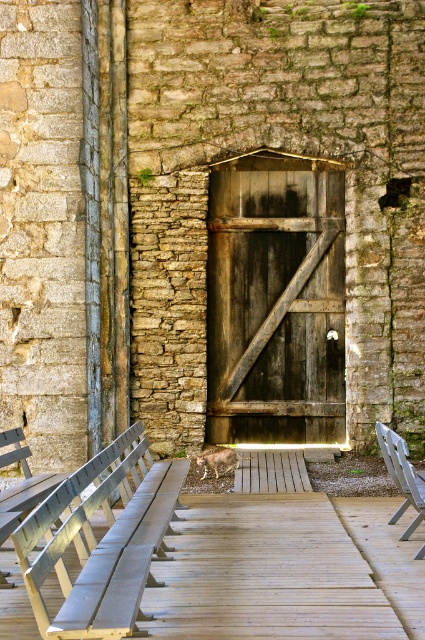
Question: Can you confirm if wooden bench at lower left is wider than metallic silver bench at center?

Choices:
 (A) no
 (B) yes

Answer: (B)

Question: Which point is closer to the camera?

Choices:
 (A) (410, 492)
 (B) (121, 460)
 (C) (283, 298)

Answer: (A)

Question: Can you confirm if wooden bench at lower left is positioned to the right of metallic silver bench at center?

Choices:
 (A) no
 (B) yes

Answer: (A)

Question: Which point is farther to the camera?

Choices:
 (A) metallic silver bench at center
 (B) wooden bench at lower left
 (C) dark brown wooden door at center

Answer: (C)

Question: Which point appears closest to the camera in this image?

Choices:
 (A) (377, 440)
 (B) (31, 538)

Answer: (B)

Question: Does dark brown wooden door at center appear over wooden bench at lower left?

Choices:
 (A) no
 (B) yes

Answer: (B)